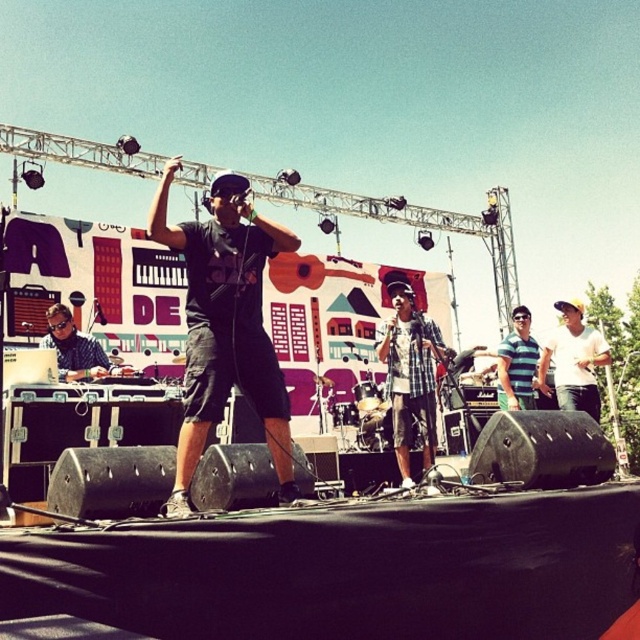
Question: Does black matte shirt at center lie behind matte black headphones at center?

Choices:
 (A) no
 (B) yes

Answer: (A)

Question: Does checkered fabric shirt at center lie in front of white cotton shirt at center?

Choices:
 (A) yes
 (B) no

Answer: (A)

Question: Among these objects, which one is farthest from the camera?

Choices:
 (A) checkered fabric shirt at center
 (B) white cotton shirt at center
 (C) blue striped shirt at center

Answer: (C)

Question: Which of the following is the closest to the observer?

Choices:
 (A) matte black headphones at center
 (B) black matte shirt at center
 (C) white cotton shirt at center
 (D) blue striped shirt at center

Answer: (B)

Question: Which object is the farthest from the black matte shirt at center?

Choices:
 (A) checkered fabric shirt at center
 (B) white cotton shirt at center

Answer: (B)

Question: Is the position of black matte shirt at center less distant than that of matte black headphones at center?

Choices:
 (A) yes
 (B) no

Answer: (A)